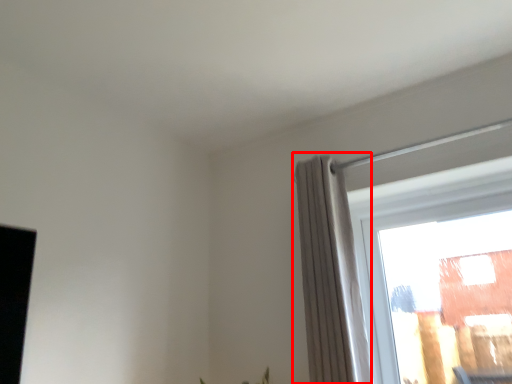
Question: From the image's perspective, considering the relative positions of curtain (annotated by the red box) and window in the image provided, where is curtain (annotated by the red box) located with respect to the staircase?

Choices:
 (A) above
 (B) below

Answer: (A)